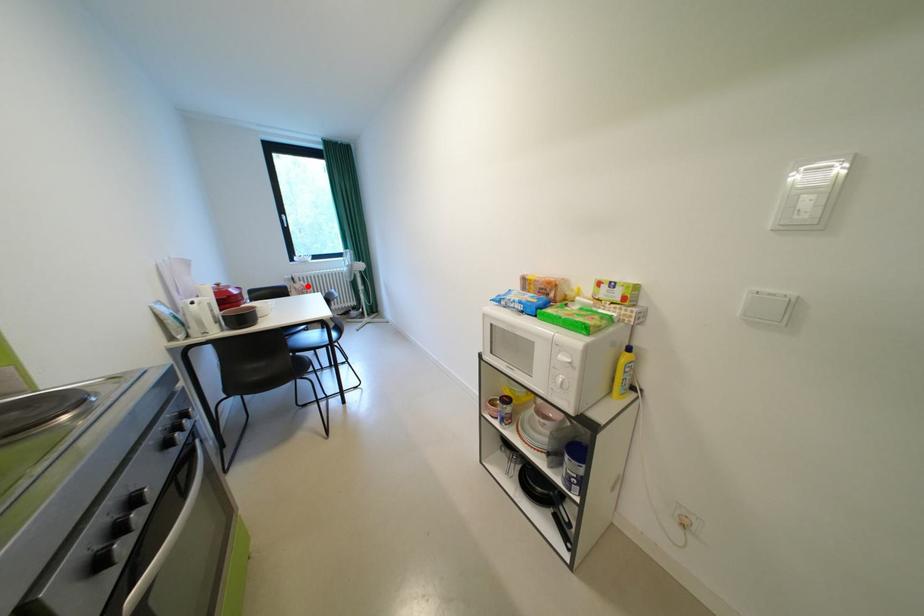
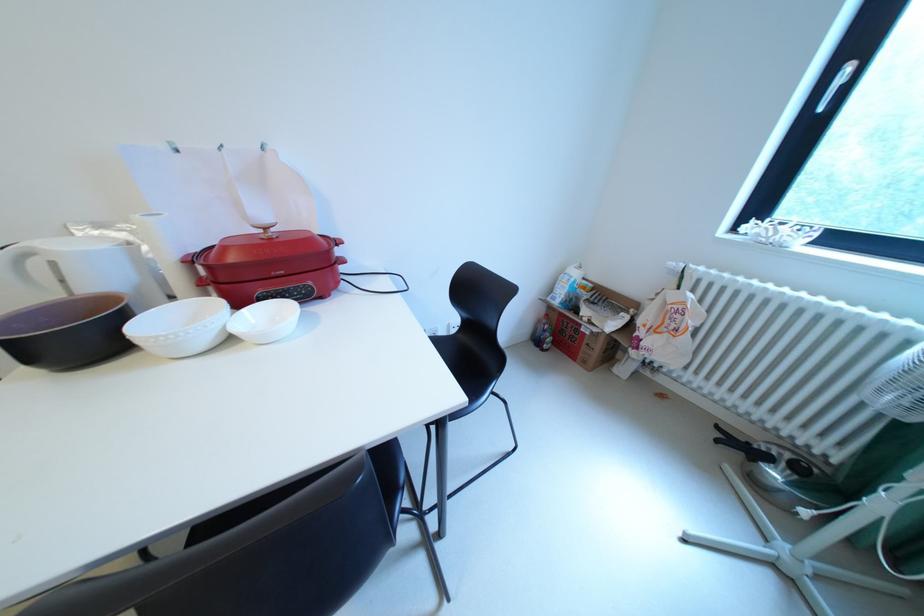
The point at the highlighted location is marked in the first image. Where is the corresponding point in the second image?

(682, 297)